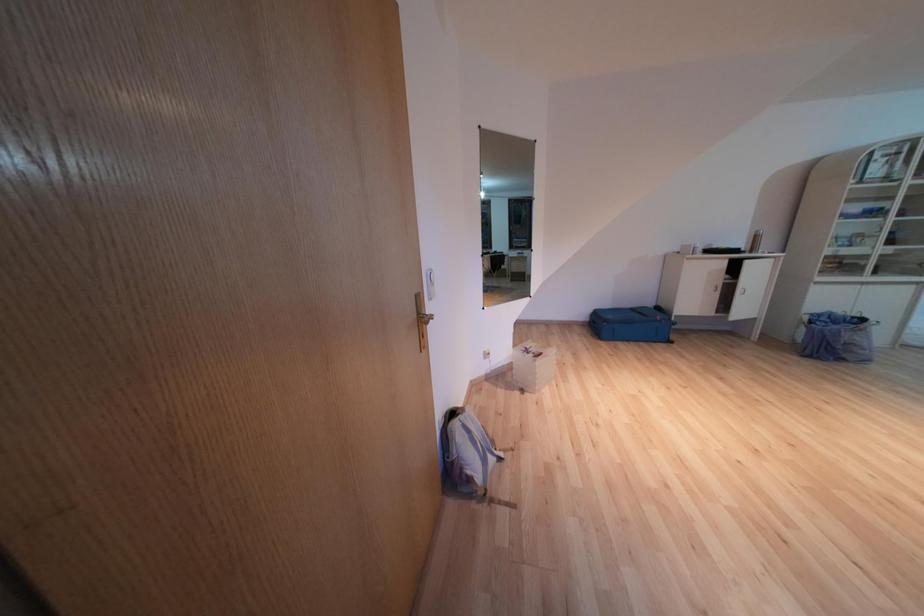
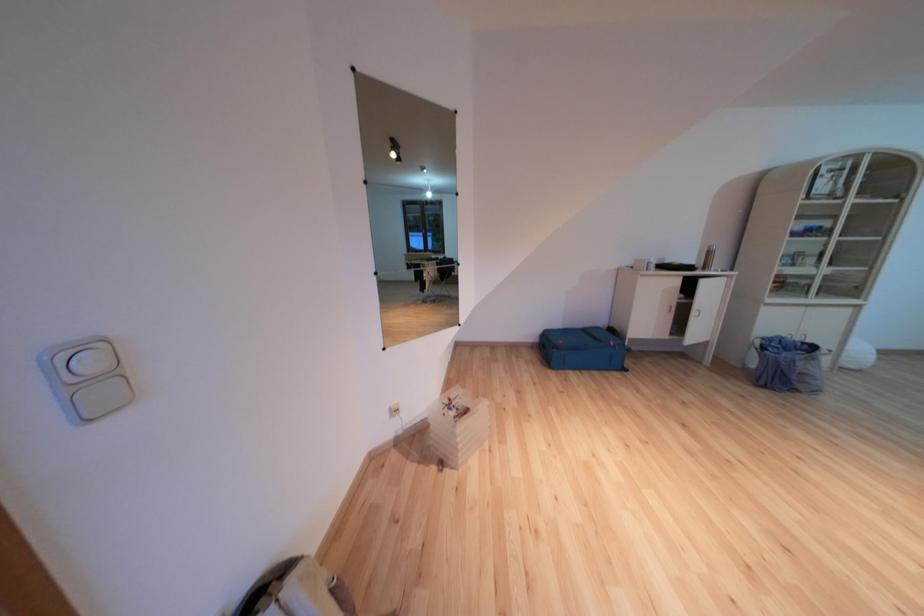
The images are taken continuously from a first-person perspective. In which direction are you moving?

The movement direction of the cameraman is right, forward.